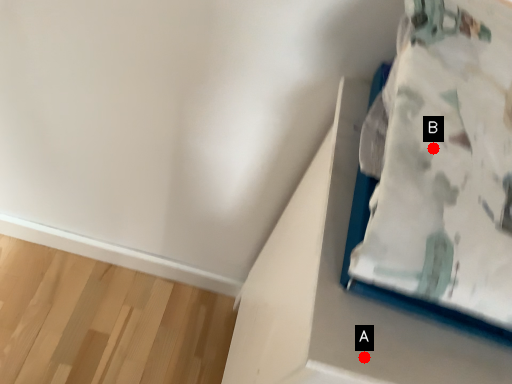
Question: Two points are circled on the image, labeled by A and B beside each circle. Among these points, which one is nearest to the camera?

Choices:
 (A) A is closer
 (B) B is closer

Answer: (B)